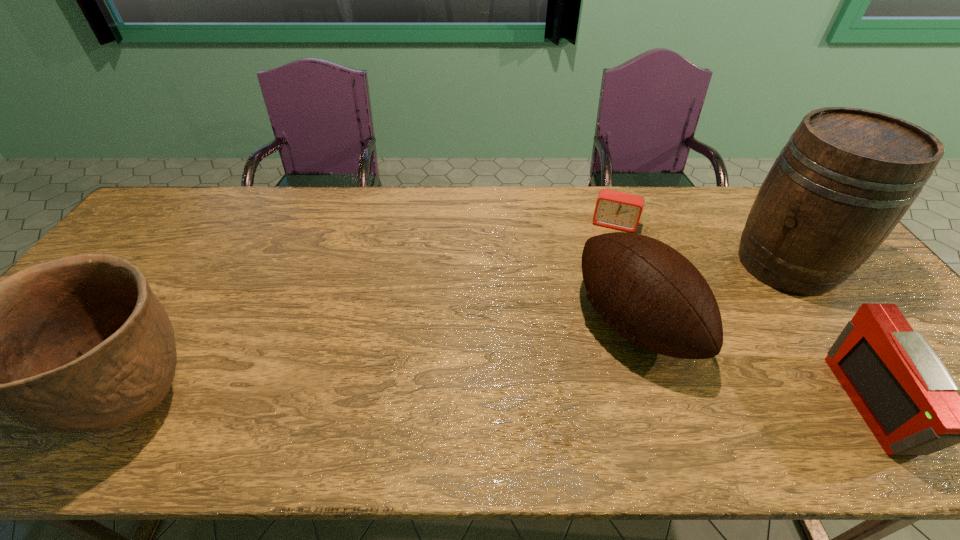
Where is `vacant space on the desktop that is between the leftmost object and the fourth tallest object and is positioned on the laces of the football`? vacant space on the desktop that is between the leftmost object and the fourth tallest object and is positioned on the laces of the football is located at coordinates (489, 404).

Find the location of a particular element. free space on the desktop that is between the pottery and the fourth tallest object and is positioned on the front-facing side of the alarm clock is located at coordinates (567, 404).

Identify the location of free spot on the desktop that is between the pottery and the camera and is positioned on the side of the tallest object near the bung hole. The height and width of the screenshot is (540, 960). point(558,404).